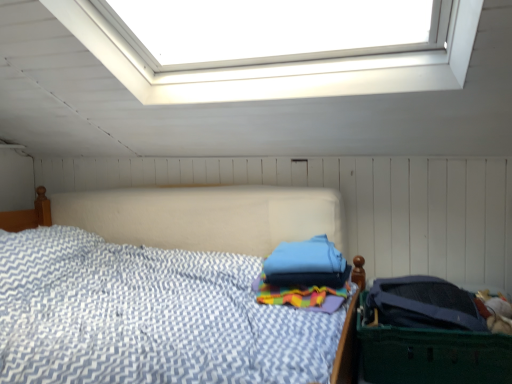
Question: From the image's perspective, is blue fabric pillow at center located above or below dark green plastic laundry basket at right?

Choices:
 (A) above
 (B) below

Answer: (A)

Question: Considering the positions of blue fabric pillow at center and dark green plastic laundry basket at right in the image, is blue fabric pillow at center wider or thinner than dark green plastic laundry basket at right?

Choices:
 (A) thin
 (B) wide

Answer: (A)

Question: Considering their positions, is blue fabric pillow at center located in front of or behind dark green plastic laundry basket at right?

Choices:
 (A) front
 (B) behind

Answer: (B)

Question: Is dark green plastic laundry basket at right to the left or to the right of blue fabric pillow at center in the image?

Choices:
 (A) left
 (B) right

Answer: (B)

Question: Considering their positions, is dark green plastic laundry basket at right located in front of or behind blue fabric pillow at center?

Choices:
 (A) behind
 (B) front

Answer: (B)

Question: Considering the positions of dark green plastic laundry basket at right and blue fabric pillow at center in the image, is dark green plastic laundry basket at right wider or thinner than blue fabric pillow at center?

Choices:
 (A) wide
 (B) thin

Answer: (A)

Question: Considering the positions of dark green plastic laundry basket at right and blue fabric pillow at center in the image, is dark green plastic laundry basket at right bigger or smaller than blue fabric pillow at center?

Choices:
 (A) small
 (B) big

Answer: (B)